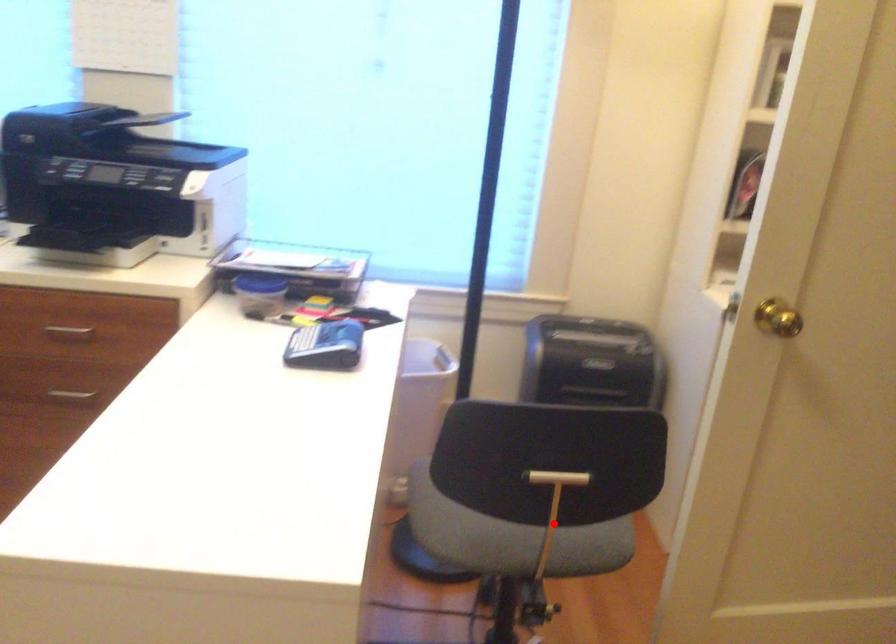
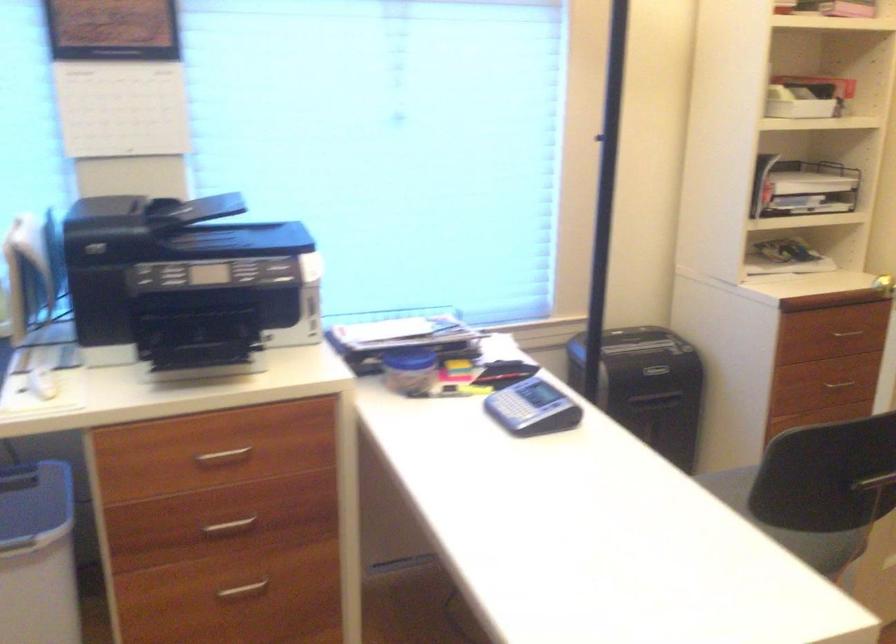
Locate, in the second image, the point that corresponds to the highlighted location in the first image.

(788, 525)